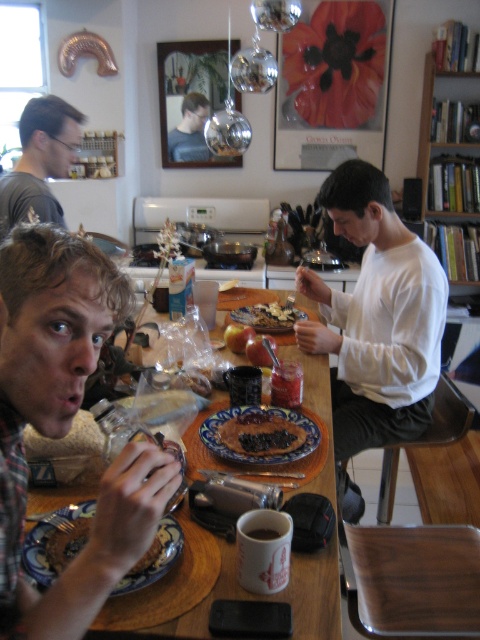
You are sitting at the dining table and want to hand a napkin to both the person wearing the plaid shirt at left and the matte black shirt at upper center. Which person will you need to reach further to give the napkin to?

The matte black shirt at upper center is further away from you than the plaid shirt at left, so you will need to reach further to give the napkin to the matte black shirt at upper center.

You are sitting at the dining table and want to reach for the blue glazed plate at center. Which direction should you move your hand relative to the matte black shirt at upper center?

The blue glazed plate at center is to the right of the matte black shirt at upper center, so you should move your hand to the right of the matte black shirt at upper center to reach it.

You are standing in the kitchen and want to reach both the point at coordinates (256, 408) and the point at coordinates (178, 145). Which point will you reach first?

You will reach point (256, 408) first because it is closer to you than point (178, 145).